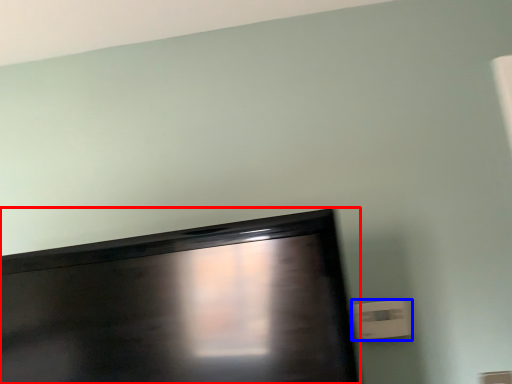
Question: Which of the following is the closest to the observer, television (highlighted by a red box) or electric outlet (highlighted by a blue box)?

Choices:
 (A) television
 (B) electric outlet

Answer: (A)